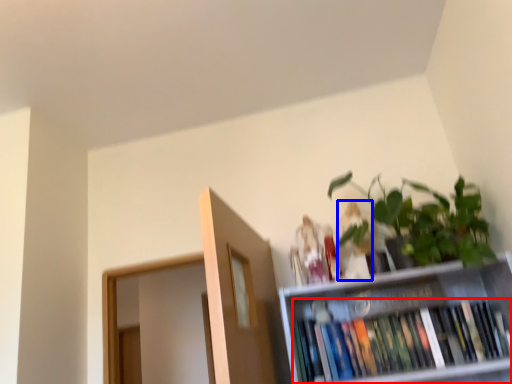
Question: Which of the following is the farthest to the observer, book (highlighted by a red box) or toy (highlighted by a blue box)?

Choices:
 (A) book
 (B) toy

Answer: (B)